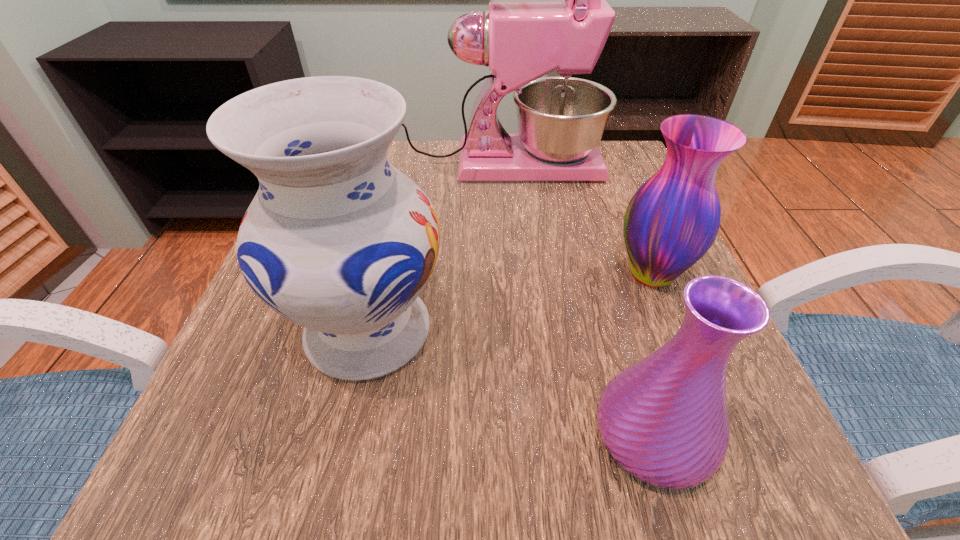
Where is `vacant space at the far edge`? The height and width of the screenshot is (540, 960). vacant space at the far edge is located at coordinates (433, 189).

The image size is (960, 540). Identify the location of vacant space at the near edge of the desktop. (445, 474).

The width and height of the screenshot is (960, 540). In the image, there is a desktop. Find the location of `free space at the left edge`. free space at the left edge is located at coordinates (198, 422).

This screenshot has width=960, height=540. What are the coordinates of `vacant space at the right edge of the desktop` in the screenshot? It's located at (596, 261).

In the image, there is a desktop. Find the location of `vacant space at the near left corner`. vacant space at the near left corner is located at coordinates (308, 443).

This screenshot has height=540, width=960. What are the coordinates of `object that is the third closest to the tallest vase` in the screenshot? It's located at (672, 220).

Where is `object identified as the second closest to the mixer`? This screenshot has width=960, height=540. object identified as the second closest to the mixer is located at coordinates (x=337, y=240).

Image resolution: width=960 pixels, height=540 pixels. Find the location of `vase that is the second closest to the leftmost vase`. vase that is the second closest to the leftmost vase is located at coordinates (672, 220).

The width and height of the screenshot is (960, 540). What are the coordinates of `the closest vase to the farthest object` in the screenshot? It's located at (672, 220).